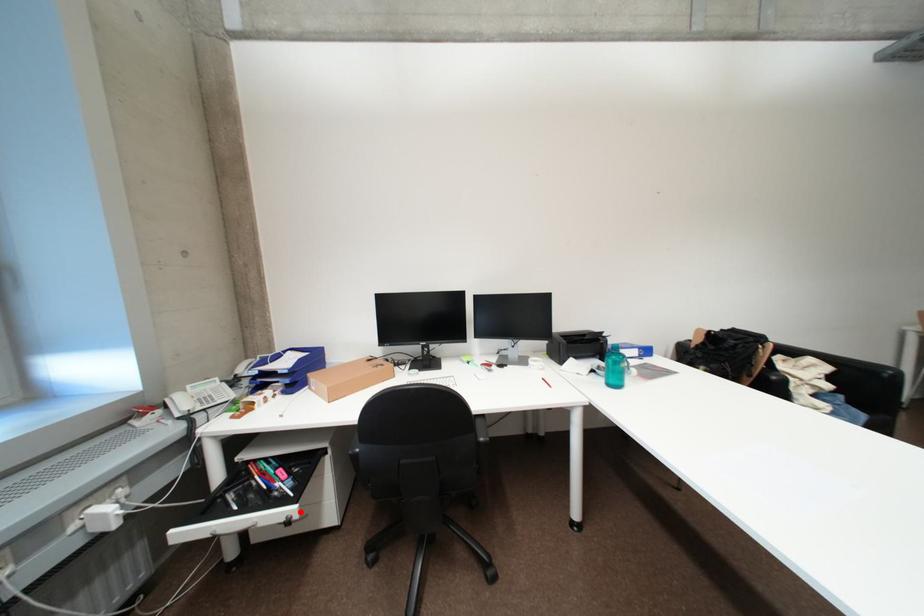
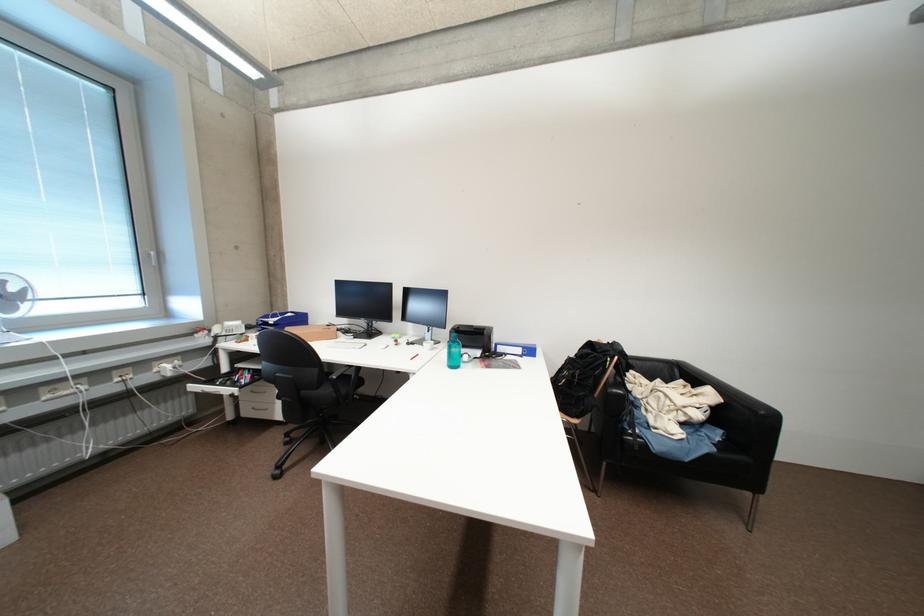
Question: A red point is marked in image1. In image2, is the corresponding 3D point closer to the camera or farther? Reply with the corresponding letter.

Choices:
 (A) The corresponding 3D point is closer.
 (B) The corresponding 3D point is farther.

Answer: (B)